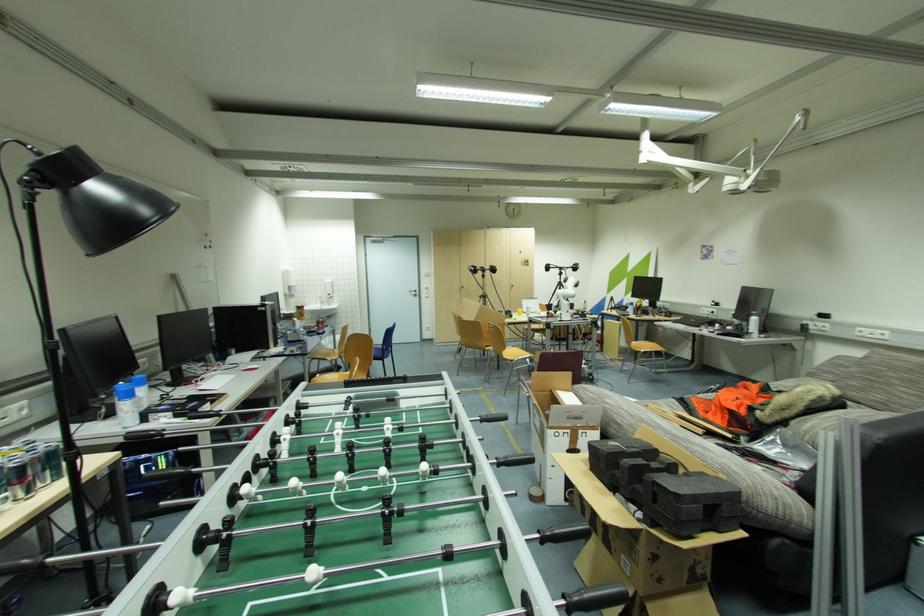
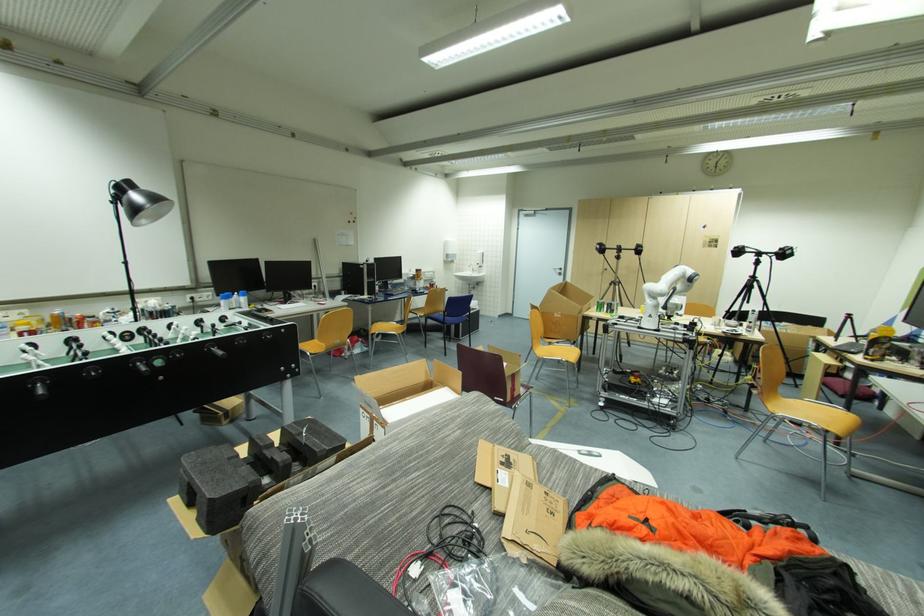
The point at (572,419) is marked in the first image. Where is the corresponding point in the second image?

(369, 403)